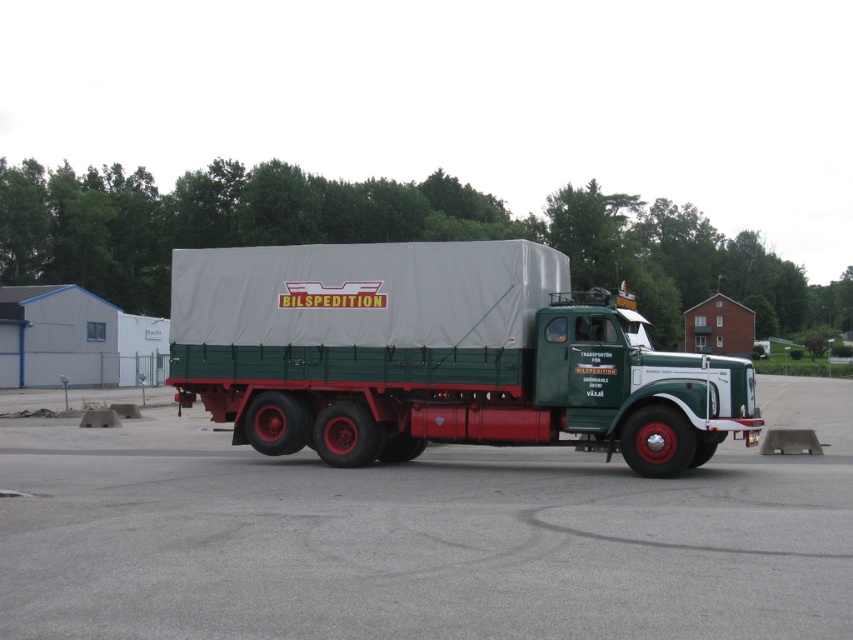
Question: Which point appears farthest from the camera in this image?

Choices:
 (A) (682, 468)
 (B) (566, 520)

Answer: (A)

Question: Among these points, which one is nearest to the camera?

Choices:
 (A) (630, 636)
 (B) (351, 268)

Answer: (A)

Question: Does gray asphalt parking lot at center appear on the right side of green matte truck at center?

Choices:
 (A) yes
 (B) no

Answer: (A)

Question: Does gray asphalt parking lot at center appear on the right side of green matte truck at center?

Choices:
 (A) yes
 (B) no

Answer: (A)

Question: Is gray asphalt parking lot at center to the right of green matte truck at center from the viewer's perspective?

Choices:
 (A) no
 (B) yes

Answer: (B)

Question: Which of the following is the closest to the observer?

Choices:
 (A) (811, 508)
 (B) (451, 346)

Answer: (A)